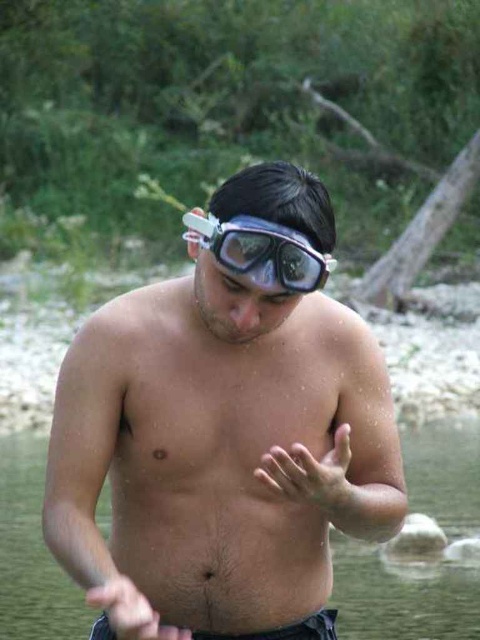
Question: Which of the following is the farthest from the observer?

Choices:
 (A) (132, 612)
 (B) (268, 472)
 (C) (33, 492)

Answer: (C)

Question: Does clear plastic goggles at center have a smaller size compared to transparent rubber goggles at center?

Choices:
 (A) yes
 (B) no

Answer: (B)

Question: Which point is closer to the camera?

Choices:
 (A) (275, 593)
 (B) (91, 588)
 (C) (33, 452)
 (D) (296, 291)

Answer: (B)

Question: Considering the relative positions of pale skin hand at center and smooth skin hand at center in the image provided, where is pale skin hand at center located with respect to smooth skin hand at center?

Choices:
 (A) left
 (B) right

Answer: (B)

Question: Is clear plastic goggles at center smaller than pale skin hand at center?

Choices:
 (A) no
 (B) yes

Answer: (A)

Question: Which point is closer to the camera?

Choices:
 (A) (269, 221)
 (B) (369, 628)

Answer: (A)